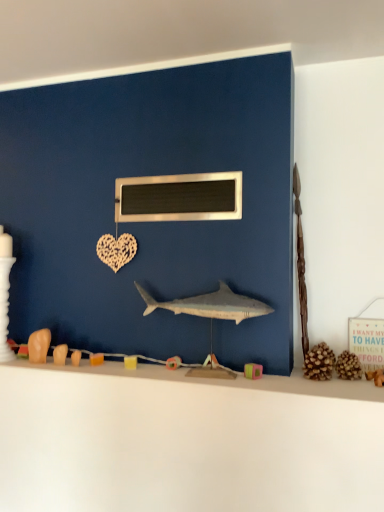
Identify the location of white matte counter top at lower center. (186, 441).

The image size is (384, 512). I want to click on medicine cabinet positioned vertically above the white matte counter top at lower center (from a real-world perspective), so click(179, 198).

Is metallic rectangular object at center situated inside white matte counter top at lower center or outside?

metallic rectangular object at center is not inside white matte counter top at lower center, it's outside.

Is metallic rectangular object at center positioned far away from white matte counter top at lower center?

metallic rectangular object at center is actually quite close to white matte counter top at lower center.

Considering the positions of objects metallic rectangular object at center and white matte counter top at lower center in the image provided, who is more to the left, metallic rectangular object at center or white matte counter top at lower center?

From the viewer's perspective, white matte counter top at lower center appears more on the left side.

Is metallic rectangular object at center positioned behind blue matte wall at center?

Yes, metallic rectangular object at center is further from the camera.

Is metallic rectangular object at center smaller than blue matte wall at center?

Correct, metallic rectangular object at center occupies less space than blue matte wall at center.

Which object is positioned more to the right, metallic rectangular object at center or blue matte wall at center?

Positioned to the right is metallic rectangular object at center.

From a real-world perspective, is metallic rectangular object at center over blue matte wall at center?

Indeed, from a real-world perspective, metallic rectangular object at center stands above blue matte wall at center.

How much distance is there between white matte counter top at lower center and smooth gray shark at center?

A distance of 41.38 centimeters exists between white matte counter top at lower center and smooth gray shark at center.

Can we say white matte counter top at lower center lies outside smooth gray shark at center?

Yes, white matte counter top at lower center is not within smooth gray shark at center.

Does point (311, 386) appear closer or farther from the camera than point (257, 308)?

Point (311, 386).

Which is correct: smooth gray shark at center is inside blue matte wall at center, or outside of it?

smooth gray shark at center is not enclosed by blue matte wall at center.

Does smooth gray shark at center turn towards blue matte wall at center?

No, smooth gray shark at center does not turn towards blue matte wall at center.

Which is closer to the camera, (153, 309) or (222, 170)?

Positioned in front is point (222, 170).

Is smooth gray shark at center placed right next to white matte counter top at lower center?

No, smooth gray shark at center is not beside white matte counter top at lower center.

Does smooth gray shark at center turn towards white matte counter top at lower center?

No, smooth gray shark at center is not turned towards white matte counter top at lower center.

From a real-world perspective, is smooth gray shark at center physically located above or below white matte counter top at lower center?

smooth gray shark at center is above white matte counter top at lower center.

Considering their positions, is smooth gray shark at center located in front of or behind white matte counter top at lower center?

In the image, smooth gray shark at center appears behind white matte counter top at lower center.

Would you say blue matte wall at center is a long distance from white matte counter top at lower center?

No, blue matte wall at center is not far from white matte counter top at lower center.

Is point (52, 318) closer to viewer compared to point (280, 406)?

No, it is behind (280, 406).

Is blue matte wall at center outside of white matte counter top at lower center?

blue matte wall at center lies outside white matte counter top at lower center's area.

Which object is more forward, blue matte wall at center or white matte counter top at lower center?

Positioned in front is white matte counter top at lower center.

Considering the relative positions of white matte counter top at lower center and blue matte wall at center in the image provided, is white matte counter top at lower center to the left of blue matte wall at center from the viewer's perspective?

No, white matte counter top at lower center is not to the left of blue matte wall at center.

Consider the image. Which of these two, white matte counter top at lower center or blue matte wall at center, is wider?

white matte counter top at lower center.

Consider the image. In the image, is white matte counter top at lower center positioned in front of or behind blue matte wall at center?

In the image, white matte counter top at lower center appears in front of blue matte wall at center.

Which is correct: white matte counter top at lower center is inside blue matte wall at center, or outside of it?

white matte counter top at lower center lies outside blue matte wall at center.

You are a GUI agent. You are given a task and a screenshot of the screen. Output one action in this format:
    pyautogui.click(x=<x>, y=<y>)
    Task: Click on the counter top below the metallic rectangular object at center (from a real-world perspective)
    The height and width of the screenshot is (512, 384).
    Given the screenshot: What is the action you would take?
    pyautogui.click(x=186, y=441)

Image resolution: width=384 pixels, height=512 pixels. Find the location of `medicine cabinet located above the blue matte wall at center (from the image's perspective)`. medicine cabinet located above the blue matte wall at center (from the image's perspective) is located at coordinates (179, 198).

Which object lies further to the anchor point smooth gray shark at center, metallic rectangular object at center or blue matte wall at center?

Among the two, blue matte wall at center is located further to smooth gray shark at center.

Estimate the real-world distances between objects in this image. Which object is closer to blue matte wall at center, metallic rectangular object at center or white matte counter top at lower center?

metallic rectangular object at center is positioned closer to the anchor blue matte wall at center.

Which object lies further to the anchor point metallic rectangular object at center, blue matte wall at center or smooth gray shark at center?

The object further to metallic rectangular object at center is smooth gray shark at center.

Based on their spatial positions, is smooth gray shark at center or metallic rectangular object at center further from white matte counter top at lower center?

metallic rectangular object at center lies further to white matte counter top at lower center than the other object.

In the scene shown: When comparing their distances from metallic rectangular object at center, does smooth gray shark at center or white matte counter top at lower center seem closer?

Among the two, smooth gray shark at center is located nearer to metallic rectangular object at center.

Consider the image. Estimate the real-world distances between objects in this image. Which object is further from metallic rectangular object at center, white matte counter top at lower center or blue matte wall at center?

white matte counter top at lower center is further to metallic rectangular object at center.

From the image, which object appears to be farther from smooth gray shark at center, metallic rectangular object at center or white matte counter top at lower center?

The object further to smooth gray shark at center is white matte counter top at lower center.

Estimate the real-world distances between objects in this image. Which object is closer to white matte counter top at lower center, blue matte wall at center or metallic rectangular object at center?

Among the two, blue matte wall at center is located nearer to white matte counter top at lower center.

At what (x,y) coordinates should I click in order to perform the action: click on backdrop that lies between metallic rectangular object at center and smooth gray shark at center from top to bottom. Please return your answer as a coordinate pair (x, y). This screenshot has height=512, width=384. Looking at the image, I should click on (151, 222).

The height and width of the screenshot is (512, 384). I want to click on shark between metallic rectangular object at center and white matte counter top at lower center from top to bottom, so click(210, 305).

I want to click on backdrop between metallic rectangular object at center and white matte counter top at lower center in the vertical direction, so click(151, 222).

Find the location of a particular element. shark between blue matte wall at center and white matte counter top at lower center vertically is located at coordinates (210, 305).